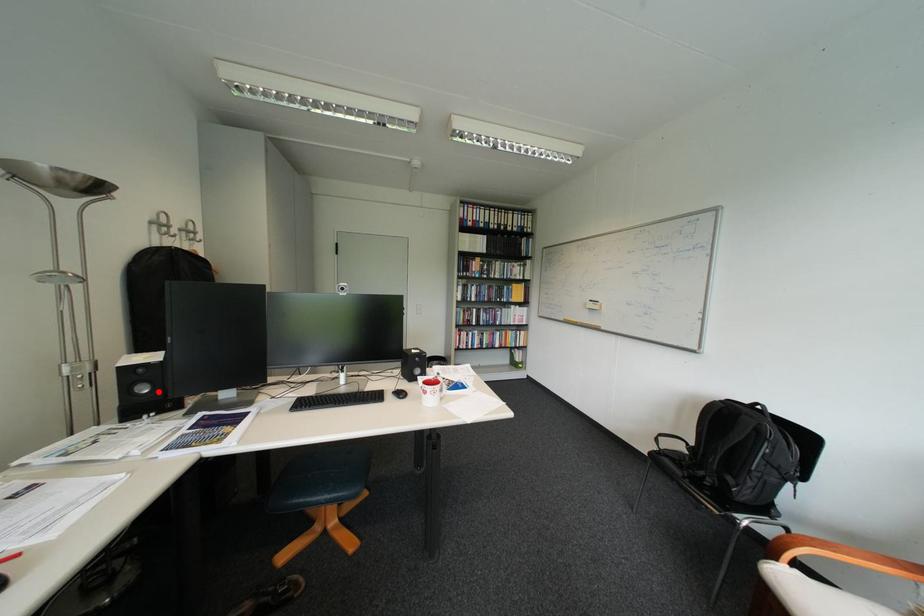
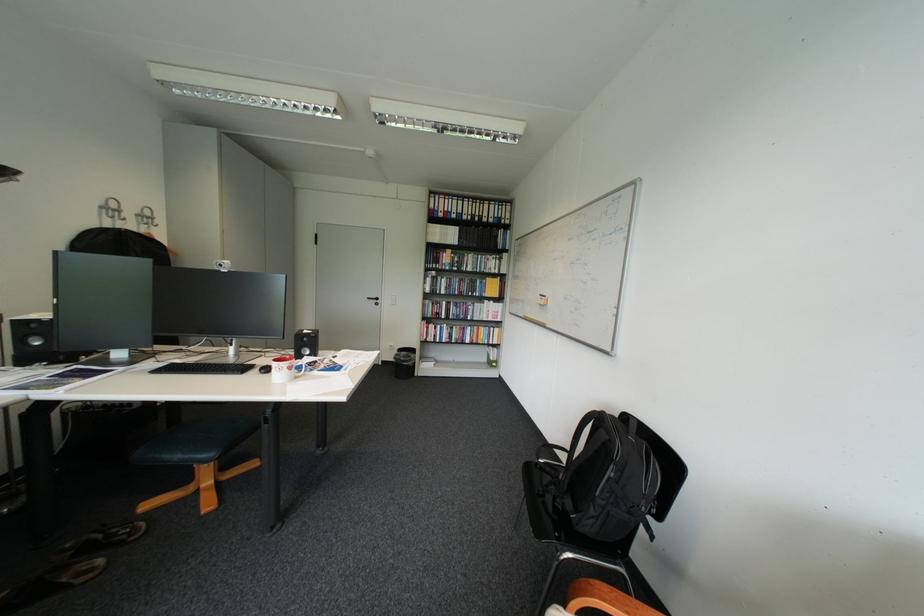
The point at the highlighted location is marked in the first image. Where is the corresponding point in the second image?

(51, 344)